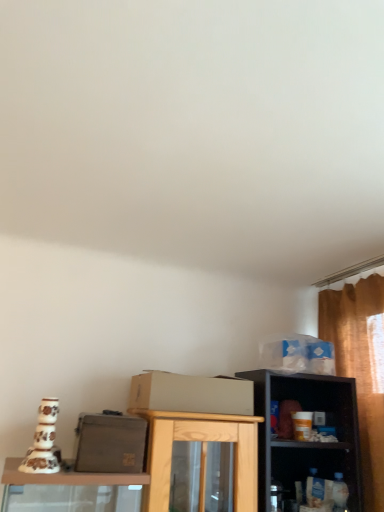
In order to face beige cardboard box at center, should I rotate leftwards or rightwards?

It's best to rotate left around 0.264 degrees.

Find the location of a particular element. This screenshot has width=384, height=512. beige cardboard box at center is located at coordinates (191, 394).

Where is `white plastic shelf at lower right`? white plastic shelf at lower right is located at coordinates (314, 466).

Image resolution: width=384 pixels, height=512 pixels. In order to click on blue plastic bag at upper right, the 2th box in the front-to-back sequence in this screenshot , I will do `click(297, 354)`.

The image size is (384, 512). In order to click on matte gray box at center, the first box from the bottom in this screenshot , I will do `click(110, 443)`.

Which object is closer to the camera, white plastic shelf at lower right or beige cardboard box at center?

beige cardboard box at center is in front.

Between white plastic shelf at lower right and beige cardboard box at center, which one appears on the right side from the viewer's perspective?

white plastic shelf at lower right.

Are white plastic shelf at lower right and beige cardboard box at center beside each other?

No, white plastic shelf at lower right is not next to beige cardboard box at center.

Which of these two, white plastic shelf at lower right or beige cardboard box at center, is bigger?

beige cardboard box at center is bigger.

Between blue plastic bag at upper right, placed as the 1th box when sorted from top to bottom, and beige cardboard box at center, which one has smaller width?

blue plastic bag at upper right, placed as the 1th box when sorted from top to bottom.

From the picture: Is blue plastic bag at upper right, placed as the 1th box when sorted from top to bottom, positioned beyond the bounds of beige cardboard box at center?

blue plastic bag at upper right, placed as the 1th box when sorted from top to bottom, lies outside beige cardboard box at center's area.

From their relative heights in the image, would you say blue plastic bag at upper right, arranged as the 1th box when viewed from the right, is taller or shorter than beige cardboard box at center?

Considering their sizes, blue plastic bag at upper right, arranged as the 1th box when viewed from the right, has more height than beige cardboard box at center.

Does point (310, 340) lie in front of point (142, 381)?

No, it is behind (142, 381).

Considering the points (86, 429) and (301, 452), which point is in front, point (86, 429) or point (301, 452)?

The point (86, 429) is more forward.

Looking at this image, from a real-world perspective, who is located lower, matte gray box at center, the 2th box when ordered from right to left, or white plastic shelf at lower right?

white plastic shelf at lower right, from a real-world perspective.

You are a GUI agent. You are given a task and a screenshot of the screen. Output one action in this format:
    pyautogui.click(x=<x>, y=<y>)
    Task: Click on the box that is the 1st one when counting upward from the white plastic shelf at lower right (from the image's perspective)
    Image resolution: width=384 pixels, height=512 pixels.
    Given the screenshot: What is the action you would take?
    pyautogui.click(x=110, y=443)

Is matte gray box at center, the first box from the bottom, oriented towards white plastic shelf at lower right?

No.

Is point (85, 448) closer to camera compared to point (159, 391)?

Yes, point (85, 448) is in front of point (159, 391).

Does matte gray box at center, the first box from the bottom, have a greater height compared to beige cardboard box at center?

Yes, matte gray box at center, the first box from the bottom, is taller than beige cardboard box at center.

Does matte gray box at center, the first box from the bottom, have a lesser width compared to beige cardboard box at center?

Correct, the width of matte gray box at center, the first box from the bottom, is less than that of beige cardboard box at center.

Who is bigger, blue plastic bag at upper right, arranged as the 1th box when viewed from the right, or white plastic shelf at lower right?

Bigger between the two is white plastic shelf at lower right.

In terms of width, does blue plastic bag at upper right, arranged as the 1th box when viewed from the right, look wider or thinner when compared to white plastic shelf at lower right?

Considering their sizes, blue plastic bag at upper right, arranged as the 1th box when viewed from the right, looks slimmer than white plastic shelf at lower right.

Would you say blue plastic bag at upper right, positioned as the second box in left-to-right order, is to the left or to the right of white plastic shelf at lower right in the picture?

From the image, it's evident that blue plastic bag at upper right, positioned as the second box in left-to-right order, is to the left of white plastic shelf at lower right.

Which is more to the right, beige cardboard box at center or white plastic shelf at lower right?

From the viewer's perspective, white plastic shelf at lower right appears more on the right side.

In order to click on shelf below the beige cardboard box at center (from the image's perspective) in this screenshot , I will do `click(314, 466)`.

Can you confirm if beige cardboard box at center is bigger than white plastic shelf at lower right?

Yes.

Is beige cardboard box at center turned away from white plastic shelf at lower right?

No, beige cardboard box at center is not facing the opposite direction of white plastic shelf at lower right.

Is there a large distance between blue plastic bag at upper right, positioned as the second box in left-to-right order, and matte gray box at center, the first box from the bottom?

No, blue plastic bag at upper right, positioned as the second box in left-to-right order, is not far from matte gray box at center, the first box from the bottom.

Is blue plastic bag at upper right, the 1th box viewed from the back, taller or shorter than matte gray box at center, which is the 1th box from left to right?

Clearly, blue plastic bag at upper right, the 1th box viewed from the back, is shorter compared to matte gray box at center, which is the 1th box from left to right.

Is blue plastic bag at upper right, placed as the 2th box when sorted from bottom to top, surrounding matte gray box at center, which is the 1th box from left to right?

No, matte gray box at center, which is the 1th box from left to right, is not surrounded by blue plastic bag at upper right, placed as the 2th box when sorted from bottom to top.

From the image's perspective, would you say blue plastic bag at upper right, the 1th box viewed from the back, is positioned over matte gray box at center, arranged as the 2th box when viewed from the top?

Yes, from the image's perspective, blue plastic bag at upper right, the 1th box viewed from the back, is on top of matte gray box at center, arranged as the 2th box when viewed from the top.

Locate an element on the screen. This screenshot has height=512, width=384. cardboard box above the white plastic shelf at lower right (from a real-world perspective) is located at coordinates (191, 394).

Locate an element on the screen. cardboard box lying below the blue plastic bag at upper right, placed as the 1th box when sorted from top to bottom (from the image's perspective) is located at coordinates click(x=191, y=394).

Which object lies nearer to the anchor point white plastic shelf at lower right, matte gray box at center, acting as the first box starting from the front, or beige cardboard box at center?

beige cardboard box at center lies closer to white plastic shelf at lower right than the other object.

Which object lies nearer to the anchor point matte gray box at center, which is the 1th box from left to right, white plastic shelf at lower right or beige cardboard box at center?

Based on the image, beige cardboard box at center appears to be nearer to matte gray box at center, which is the 1th box from left to right.

Estimate the real-world distances between objects in this image. Which object is further from blue plastic bag at upper right, arranged as the 1th box when viewed from the right, white plastic shelf at lower right or matte gray box at center, the 2th box when ordered from right to left?

matte gray box at center, the 2th box when ordered from right to left, lies further to blue plastic bag at upper right, arranged as the 1th box when viewed from the right, than the other object.

When comparing their distances from beige cardboard box at center, does white plastic shelf at lower right or matte gray box at center, the first box from the bottom, seem further?

white plastic shelf at lower right lies further to beige cardboard box at center than the other object.

When comparing their distances from matte gray box at center, the 2th box when ordered from right to left, does beige cardboard box at center or white plastic shelf at lower right seem closer?

beige cardboard box at center is positioned closer to the anchor matte gray box at center, the 2th box when ordered from right to left.

Considering their positions, is beige cardboard box at center positioned closer to white plastic shelf at lower right than blue plastic bag at upper right, the 2th box in the front-to-back sequence?

Based on the image, blue plastic bag at upper right, the 2th box in the front-to-back sequence, appears to be nearer to white plastic shelf at lower right.

Based on their spatial positions, is matte gray box at center, the 2th box when ordered from right to left, or beige cardboard box at center further from blue plastic bag at upper right, positioned as the second box in left-to-right order?

matte gray box at center, the 2th box when ordered from right to left, is further to blue plastic bag at upper right, positioned as the second box in left-to-right order.

Which object lies nearer to the anchor point blue plastic bag at upper right, placed as the 1th box when sorted from top to bottom, beige cardboard box at center or white plastic shelf at lower right?

white plastic shelf at lower right lies closer to blue plastic bag at upper right, placed as the 1th box when sorted from top to bottom, than the other object.

Locate an element on the screen. The height and width of the screenshot is (512, 384). cardboard box between matte gray box at center, the first box from the bottom, and white plastic shelf at lower right from left to right is located at coordinates (191, 394).

At what (x,y) coordinates should I click in order to perform the action: click on cardboard box situated between matte gray box at center, arranged as the 2th box when viewed from the top, and blue plastic bag at upper right, the 2th box in the front-to-back sequence, from left to right. Please return your answer as a coordinate pair (x, y). The width and height of the screenshot is (384, 512). Looking at the image, I should click on (191, 394).

The image size is (384, 512). In order to click on box situated between beige cardboard box at center and white plastic shelf at lower right from left to right in this screenshot , I will do `click(297, 354)`.

Locate an element on the screen. This screenshot has height=512, width=384. box between matte gray box at center, which is the second box from back to front, and white plastic shelf at lower right, in the horizontal direction is located at coordinates (297, 354).